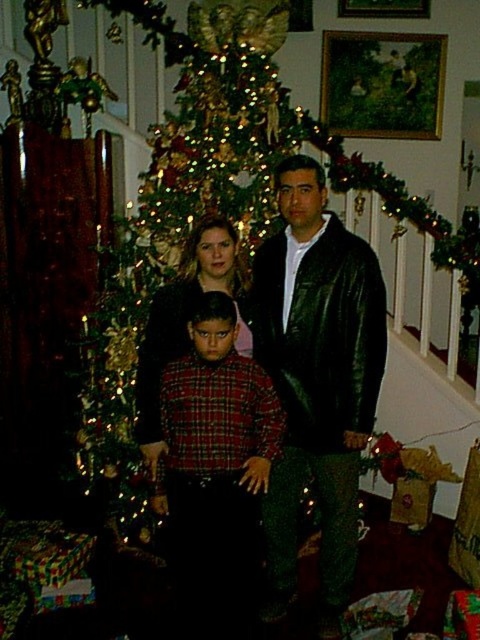
Between plaid shirt at center and matte black sweater at center, which one appears on the right side from the viewer's perspective?

Positioned to the right is plaid shirt at center.

In the scene shown: Between plaid shirt at center and matte black sweater at center, which one appears on the left side from the viewer's perspective?

matte black sweater at center is more to the left.

In order to click on plaid shirt at center in this screenshot , I will do `click(216, 468)`.

Which is behind, point (300, 394) or point (180, 332)?

Positioned behind is point (180, 332).

Can you confirm if shiny black leather jacket at center is shorter than matte black sweater at center?

No, shiny black leather jacket at center is not shorter than matte black sweater at center.

Is point (357, 406) farther from viewer compared to point (179, 344)?

No.

Where is `shiny black leather jacket at center`? shiny black leather jacket at center is located at coordinates (316, 380).

Can you confirm if plaid shirt at center is bigger than wooden framed painting at upper center?

Incorrect, plaid shirt at center is not larger than wooden framed painting at upper center.

Does plaid shirt at center appear under wooden framed painting at upper center?

Indeed, plaid shirt at center is positioned under wooden framed painting at upper center.

Is point (192, 358) more distant than point (425, 108)?

No, it is in front of (425, 108).

You are a GUI agent. You are given a task and a screenshot of the screen. Output one action in this format:
    pyautogui.click(x=<x>, y=<y>)
    Task: Click on the plaid shirt at center
    The width and height of the screenshot is (480, 640).
    Given the screenshot: What is the action you would take?
    pyautogui.click(x=216, y=468)